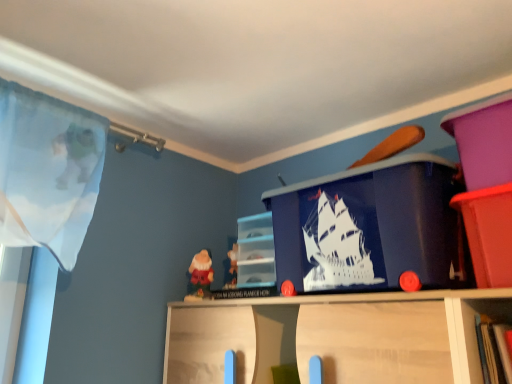
Question: From the image's perspective, relative to blue plastic ship at center, is matte plastic bin at upper right, which is counted as the first cabinet, starting from the front, above or below?

Choices:
 (A) above
 (B) below

Answer: (B)

Question: Considering their positions, is matte plastic bin at upper right, acting as the second cabinet starting from the left, located in front of or behind blue plastic ship at center?

Choices:
 (A) front
 (B) behind

Answer: (A)

Question: Which is nearer to the matte plastic bin at upper right, which is counted as the first cabinet, starting from the front?

Choices:
 (A) blue plastic ship at center
 (B) matte plastic cabinet at center, which is the 2th cabinet in front-to-back order

Answer: (A)

Question: Estimate the real-world distances between objects in this image. Which object is closer to the blue plastic ship at center?

Choices:
 (A) matte plastic bin at upper right, which ranks as the 2th cabinet in back-to-front order
 (B) matte plastic cabinet at center, which is the 2th cabinet in front-to-back order

Answer: (A)